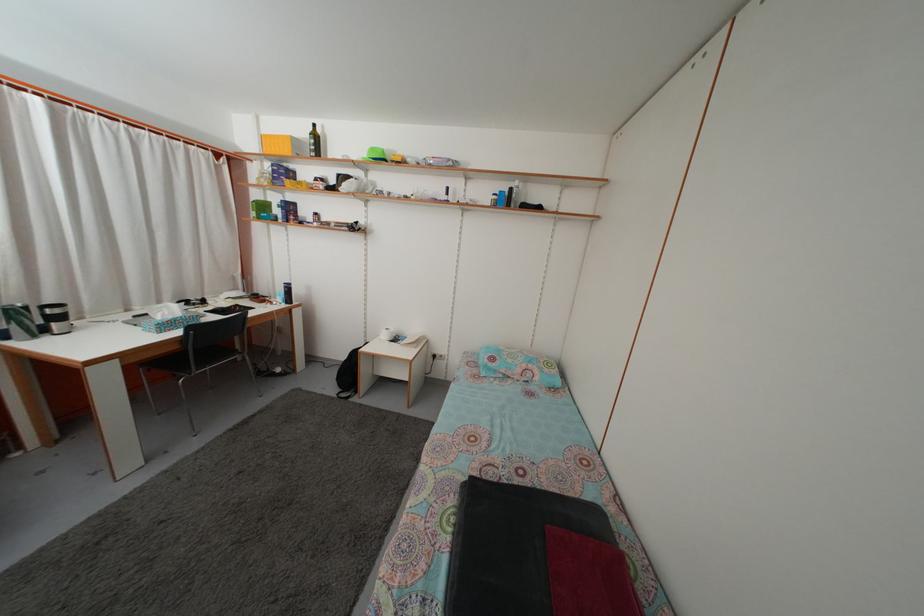
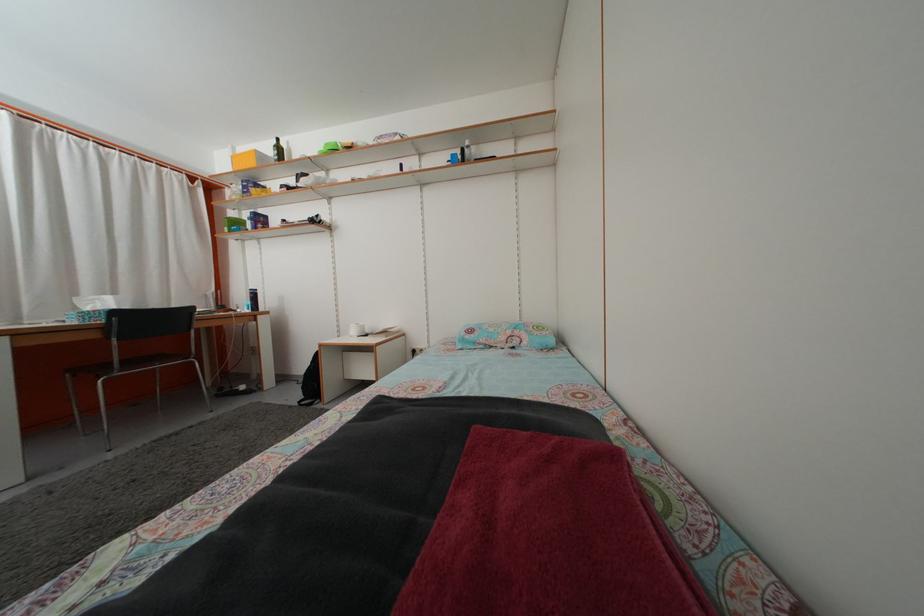
In a continuous first-person perspective shot, in which direction is the camera moving?

The cameraman moved toward right, forward.